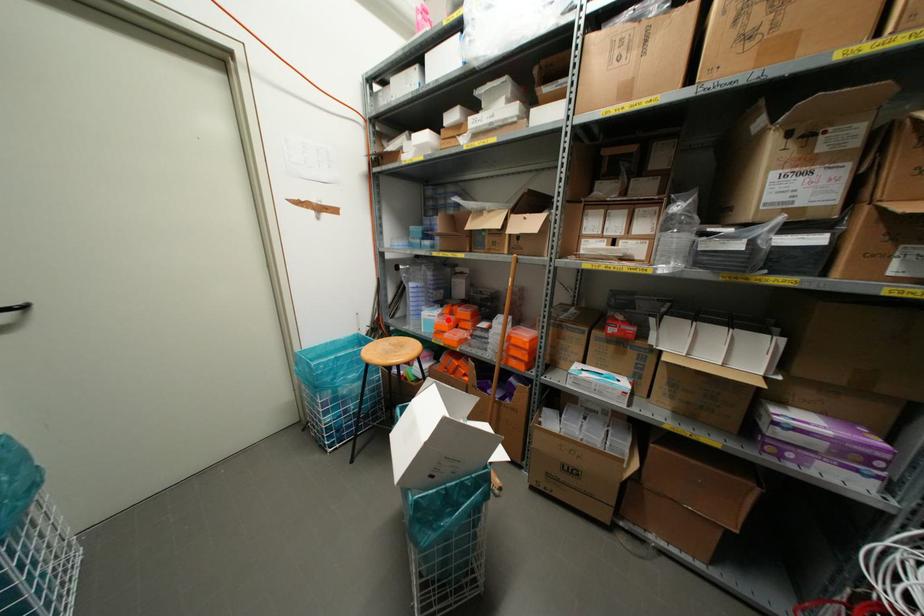
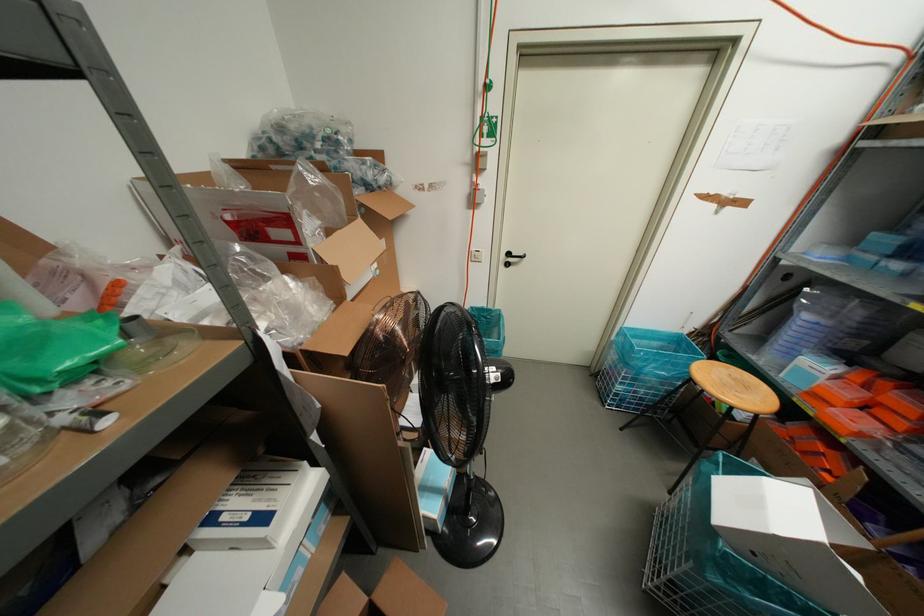
Question: I am providing you with two images of the same scene from different viewpoints. In image1, a red point is highlighted. Considering the same 3D point in image2, which of the following is correct?

Choices:
 (A) It is closer
 (B) It is farther

Answer: (B)